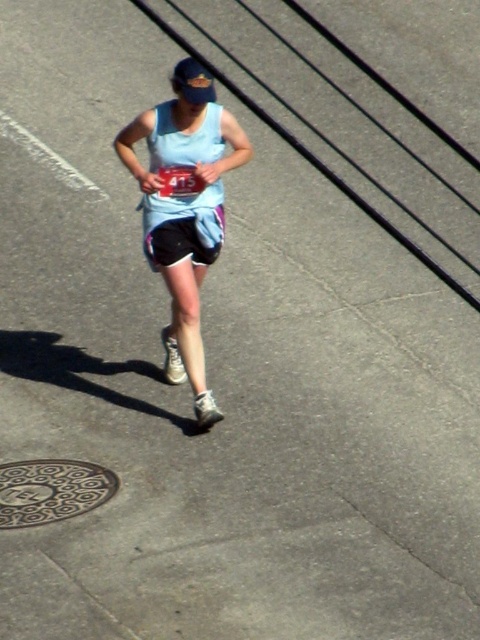
Is brown textured manhole cover at lower left positioned before light blue fabric shorts at center?

That is True.

Does brown textured manhole cover at lower left have a greater height compared to light blue fabric shorts at center?

No, brown textured manhole cover at lower left is not taller than light blue fabric shorts at center.

Who is more distant from viewer, (12, 502) or (156, 228)?

Positioned behind is point (156, 228).

This screenshot has width=480, height=640. In order to click on brown textured manhole cover at lower left in this screenshot , I will do `click(51, 490)`.

Is light blue fabric runner at center shorter than light blue fabric shorts at center?

No.

Between light blue fabric runner at center and light blue fabric shorts at center, which one has more height?

With more height is light blue fabric runner at center.

Between point (200, 113) and point (181, 216), which one is positioned behind?

Positioned behind is point (181, 216).

This screenshot has height=640, width=480. What are the coordinates of `light blue fabric runner at center` in the screenshot? It's located at (184, 209).

Consider the image. Does light blue fabric runner at center lie in front of brown textured manhole cover at lower left?

No.

Where is `light blue fabric runner at center`? The height and width of the screenshot is (640, 480). light blue fabric runner at center is located at coordinates (184, 209).

Does point (213, 417) lie in front of point (39, 470)?

No.

This screenshot has width=480, height=640. In order to click on light blue fabric runner at center in this screenshot , I will do `click(184, 209)`.